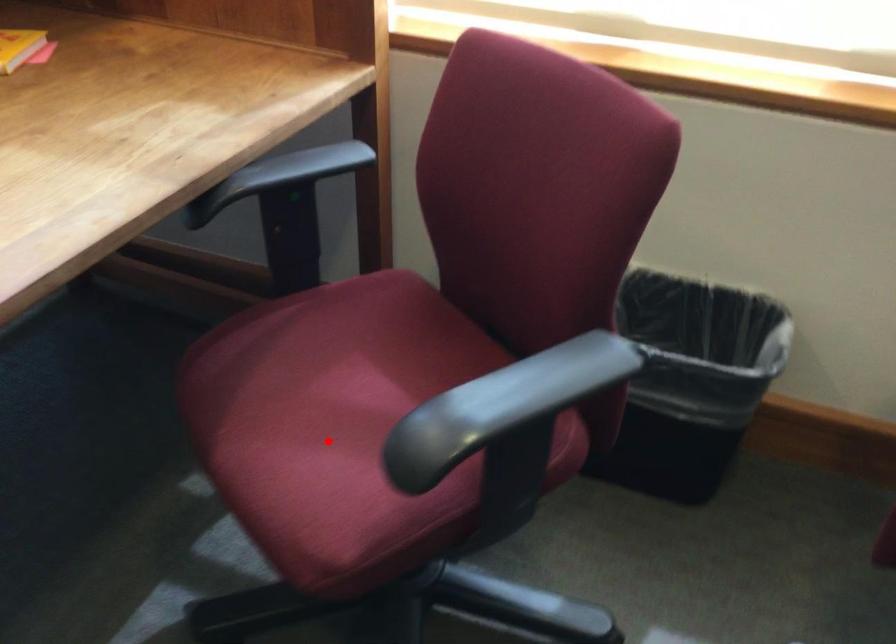
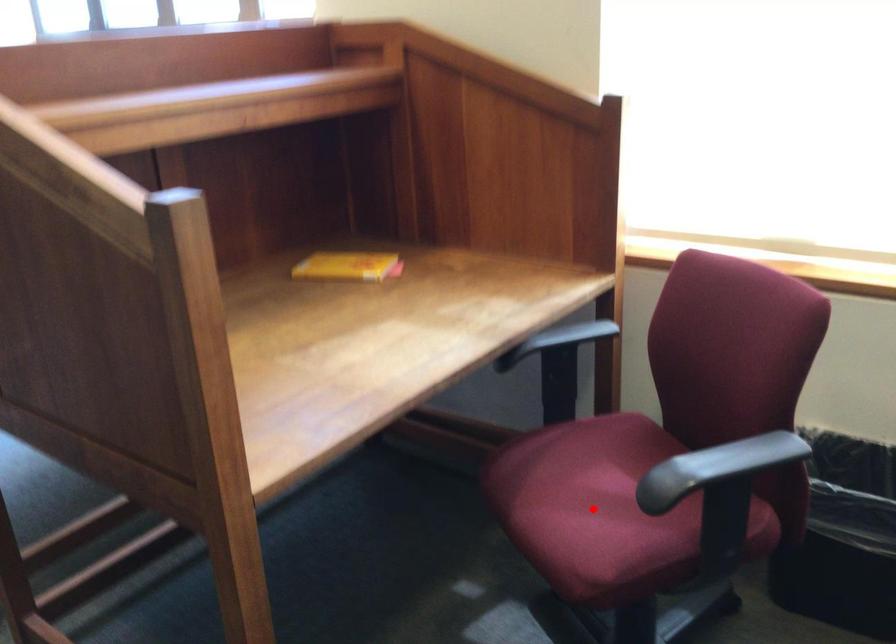
I am providing you with two images of the same scene from different viewpoints. A red point is marked on the first image and another point is marked on the second image. Are the points marked in image1 and image2 representing the same 3D position?

Yes